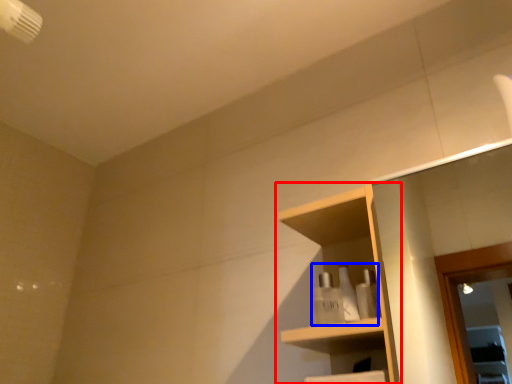
Question: Which object appears farthest to the camera in this image, shelf (highlighted by a red box) or toiletry (highlighted by a blue box)?

Choices:
 (A) shelf
 (B) toiletry

Answer: (B)